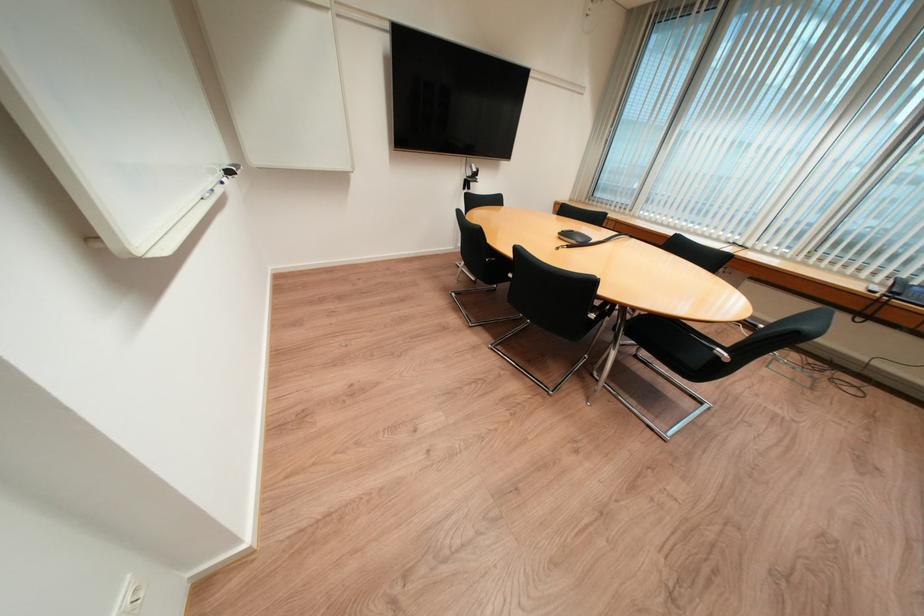
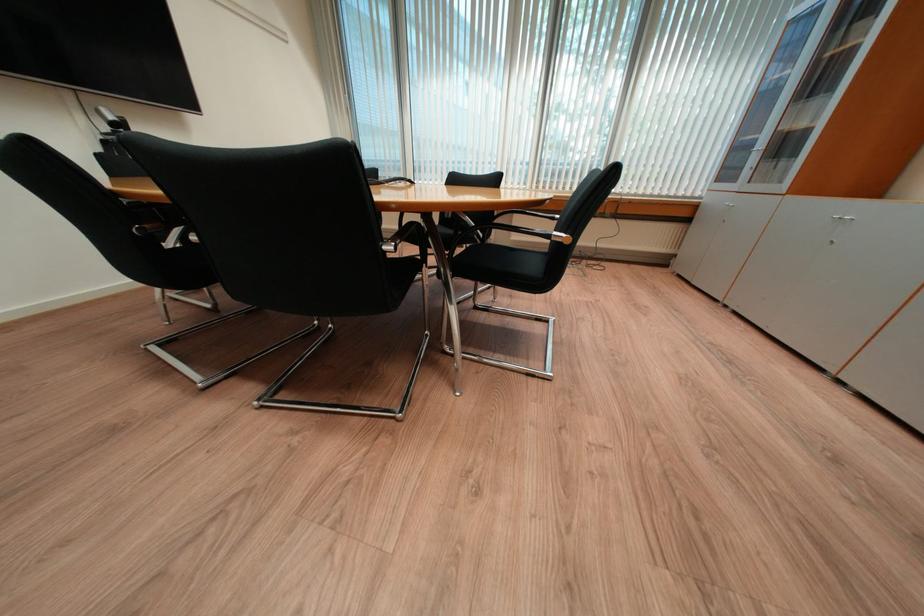
Question: Based on the continuous images, in which direction is the camera rotating? Reply with the corresponding letter.

Choices:
 (A) Left
 (B) Right
 (C) Up
 (D) Down

Answer: (B)